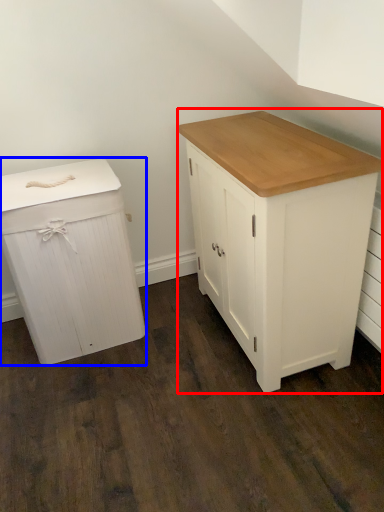
Question: Which point is closer to the camera, chest of drawers (highlighted by a red box) or chest of drawers (highlighted by a blue box)?

Choices:
 (A) chest of drawers
 (B) chest of drawers

Answer: (A)